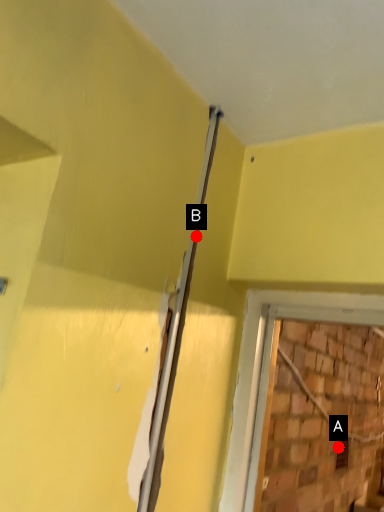
Question: Two points are circled on the image, labeled by A and B beside each circle. Which point is farther from the camera taking this photo?

Choices:
 (A) A is further
 (B) B is further

Answer: (A)